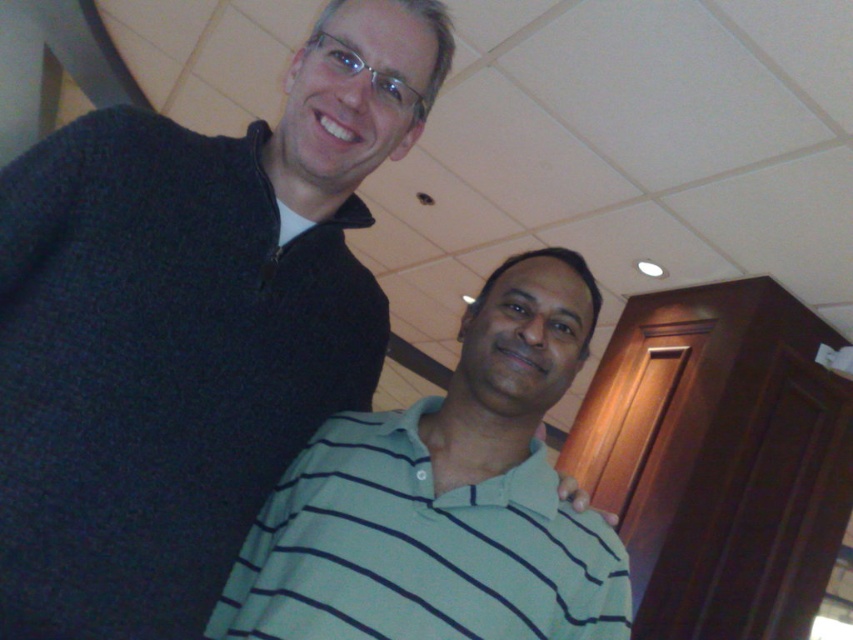
You are a photographer standing in the room. You want to take a close up of the dark blue sweater at upper left. Given that your camera can focus on objects between 24 to 36 inches away, can you take the photo without moving closer or farther from the sweater?

The dark blue sweater at upper left is 28.51 inches away from the camera, which falls within the camera focus range of 24 to 36 inches. Therefore, you can take the close up without adjusting your distance.

You are standing in the room described in the scene. There is a dark blue sweater at upper left located at point [189,326]. If you want to pick up the dark blue sweater at upper left, which direction should you move relative to your current position?

The dark blue sweater at upper left is located at point [189,326], so you should move towards the upper left direction to reach it.

Consider the image. You are a photographer setting up a shoot in this room. You need to place a spotlight on the dark blue sweater at upper left and another on the light blue striped polo shirt at center. Since the room is dimly lit, you want to ensure the spotlights are placed correctly. Which object should you place the first spotlight closer to the left side of the frame?

The dark blue sweater at upper left should be placed closer to the left side of the frame because it is positioned on the left side of the light blue striped polo shirt at center.